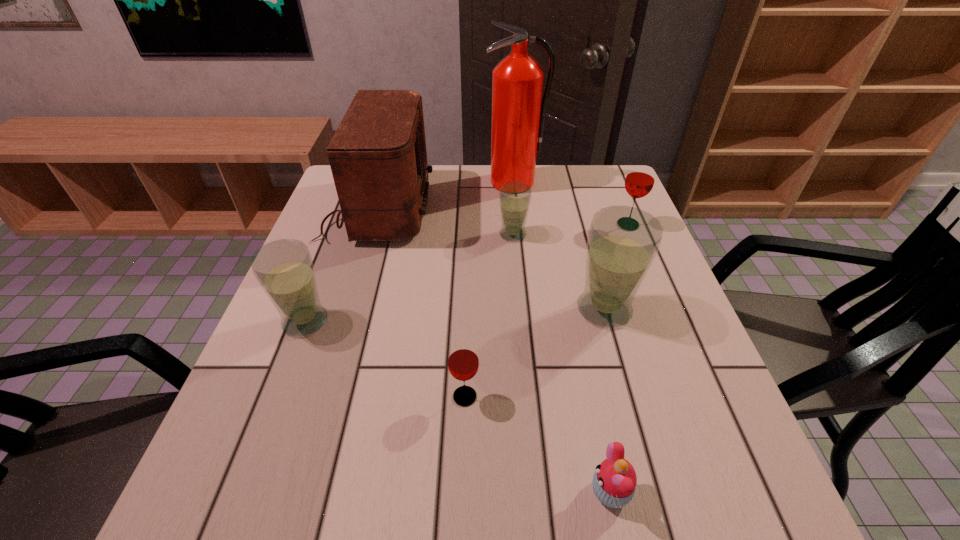
Find the location of `the second closest blue glass relative to the rightmost blue glass`. the second closest blue glass relative to the rightmost blue glass is located at coordinates (284, 269).

Where is `free space in the image that satisfies the following two spatial constraints: 1. on the front panel of the second blue glass from left to right; 2. on the right side of the second tallest object`? The height and width of the screenshot is (540, 960). free space in the image that satisfies the following two spatial constraints: 1. on the front panel of the second blue glass from left to right; 2. on the right side of the second tallest object is located at coordinates (370, 234).

The height and width of the screenshot is (540, 960). Identify the location of vacant region that satisfies the following two spatial constraints: 1. on the back side of the left red glass; 2. on the front panel of the radio receiver. (470, 208).